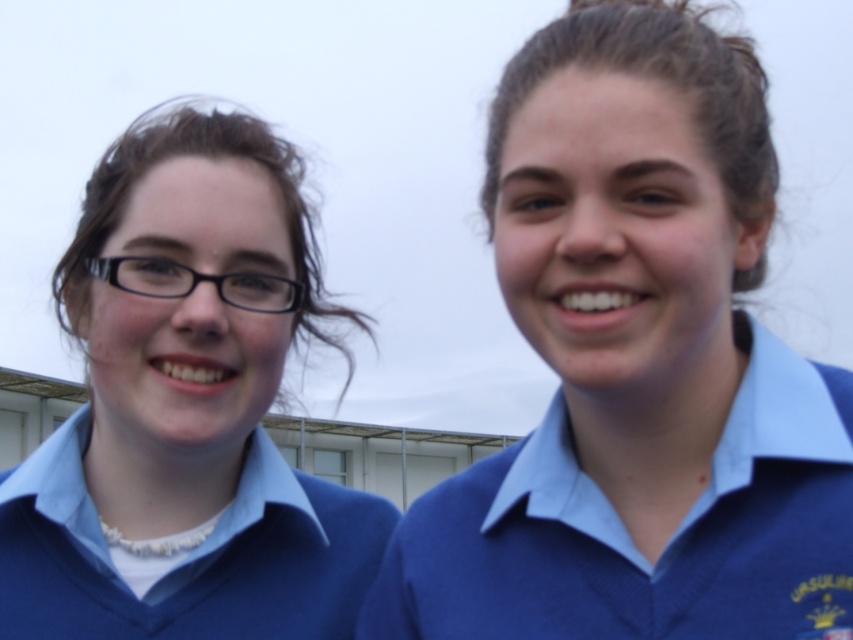
You are standing in a school courtyard and see the blue matte sweater at right. If you want to reach it within 5 seconds, what is the minimum speed you need to move towards it?

The blue matte sweater at right is 4.23 meters away. To reach it in 5 seconds, you need to move at a minimum speed of 0.85 meters per second.

You are a tailor observing two students in a school setting. You need to determine which student is wearing a sweater that is wider. The students are wearing blue matte sweater at right and matte blue sweater at left. Which one has the wider sweater?

The matte blue sweater at left is wider than the blue matte sweater at right.

You are an architect designing a new school uniform. You need to ensure that the blue matte sweater at right will fit within a 0.6x0.7 meter fabric panel. Based on its position in the image, can you confirm if the sweater will fit within the panel?

The blue matte sweater at right is positioned at coordinates (637, 365), which falls within the 0.6x0.7 meter fabric panel dimensions. Therefore, the sweater will fit within the panel.